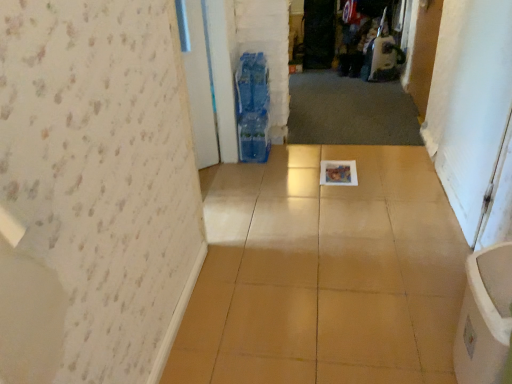
The image size is (512, 384). What do you see at coordinates (471, 106) in the screenshot?
I see `white glossy screen door at right, which is the 2th screen door in left-to-right order` at bounding box center [471, 106].

The height and width of the screenshot is (384, 512). Identify the location of white glossy screen door at right, which is the 2th screen door in left-to-right order. (471, 106).

In order to face transparent plastic screen door at center, the 2th screen door in the front-to-back sequence, should I rotate leftwards or rightwards?

Turn right approximately 8.483 degrees to face it.

You are a GUI agent. You are given a task and a screenshot of the screen. Output one action in this format:
    pyautogui.click(x=<x>, y=<y>)
    Task: Click on the wooden door at upper right
    This screenshot has height=384, width=512.
    Given the screenshot: What is the action you would take?
    pyautogui.click(x=424, y=53)

Is wooden door at upper right not within white glossy screen door at right, which is the 1th screen door from front to back?

Indeed, wooden door at upper right is completely outside white glossy screen door at right, which is the 1th screen door from front to back.

From a real-world perspective, is wooden door at upper right physically above white glossy screen door at right, which is the 2th screen door in left-to-right order?

No, from a real-world perspective, wooden door at upper right is not above white glossy screen door at right, which is the 2th screen door in left-to-right order.

Looking at this image, considering the sizes of wooden door at upper right and white glossy screen door at right, the 2th screen door from the top, in the image, is wooden door at upper right wider or thinner than white glossy screen door at right, the 2th screen door from the top,?

In the image, wooden door at upper right appears to be more narrow than white glossy screen door at right, the 2th screen door from the top.

Is white glossy screen door at right, which is the 1th screen door from front to back, shorter than transparent plastic screen door at center, the 2th screen door in the front-to-back sequence?

No.

Considering the sizes of objects white glossy screen door at right, which is the 2th screen door in left-to-right order, and transparent plastic screen door at center, the 1th screen door positioned from the back, in the image provided, who is thinner, white glossy screen door at right, which is the 2th screen door in left-to-right order, or transparent plastic screen door at center, the 1th screen door positioned from the back,?

white glossy screen door at right, which is the 2th screen door in left-to-right order.

From the image's perspective, would you say white glossy screen door at right, acting as the 1th screen door starting from the right, is positioned over transparent plastic screen door at center, the 1th screen door positioned from the back?

Actually, white glossy screen door at right, acting as the 1th screen door starting from the right, appears below transparent plastic screen door at center, the 1th screen door positioned from the back, in the image.

Is white glossy screen door at right, which appears as the second screen door when viewed from the back, not close to transparent plastic screen door at center, arranged as the 2th screen door when viewed from the right?

Yes, white glossy screen door at right, which appears as the second screen door when viewed from the back, and transparent plastic screen door at center, arranged as the 2th screen door when viewed from the right, are quite far apart.

Does point (433, 65) come in front of point (331, 16)?

Yes, point (433, 65) is in front of point (331, 16).

Is wooden door at upper right facing towards transparent plastic screen door at center, the 1th screen door positioned from the back?

No, wooden door at upper right is not aimed at transparent plastic screen door at center, the 1th screen door positioned from the back.

Between wooden door at upper right and transparent plastic screen door at center, the second screen door in the bottom-to-top sequence, which one has smaller width?

wooden door at upper right.

In terms of size, does wooden door at upper right appear bigger or smaller than transparent plastic screen door at center, the 2th screen door in the front-to-back sequence?

In the image, wooden door at upper right appears to be smaller than transparent plastic screen door at center, the 2th screen door in the front-to-back sequence.

Is white glossy screen door at right, the 2th screen door from the top, positioned far away from wooden door at upper right?

No.

From a real-world perspective, is white glossy screen door at right, which appears as the second screen door when viewed from the back, positioned over wooden door at upper right based on gravity?

Yes, from a real-world perspective, white glossy screen door at right, which appears as the second screen door when viewed from the back, is on top of wooden door at upper right.

Which of these two, white glossy screen door at right, positioned as the 1th screen door in bottom-to-top order, or wooden door at upper right, is smaller?

With smaller size is wooden door at upper right.

From the image's perspective, between white glossy screen door at right, which appears as the second screen door when viewed from the back, and wooden door at upper right, who is located below?

white glossy screen door at right, which appears as the second screen door when viewed from the back, is shown below in the image.

Are transparent plastic screen door at center, which is counted as the first screen door, starting from the left, and wooden door at upper right beside each other?

There is a gap between transparent plastic screen door at center, which is counted as the first screen door, starting from the left, and wooden door at upper right.

Is transparent plastic screen door at center, arranged as the 2th screen door when viewed from the right, oriented away from wooden door at upper right?

transparent plastic screen door at center, arranged as the 2th screen door when viewed from the right, is not turned away from wooden door at upper right.

Who is smaller, transparent plastic screen door at center, the first screen door from the top, or wooden door at upper right?

wooden door at upper right.

From the image's perspective, is transparent plastic screen door at center, which is counted as the first screen door, starting from the left, located above or below wooden door at upper right?

transparent plastic screen door at center, which is counted as the first screen door, starting from the left, is situated higher than wooden door at upper right in the image.

Does transparent plastic screen door at center, arranged as the 2th screen door when viewed from the right, touch white glossy screen door at right, which is the 2th screen door in left-to-right order?

No, transparent plastic screen door at center, arranged as the 2th screen door when viewed from the right, is not next to white glossy screen door at right, which is the 2th screen door in left-to-right order.

Consider the image. From a real-world perspective, who is located lower, transparent plastic screen door at center, which is counted as the first screen door, starting from the left, or white glossy screen door at right, the 2th screen door from the top?

transparent plastic screen door at center, which is counted as the first screen door, starting from the left, is physically lower.

How far apart are transparent plastic screen door at center, the second screen door in the bottom-to-top sequence, and white glossy screen door at right, which is the 1th screen door from front to back?

They are 7.72 feet apart.

From the image's perspective, which one is positioned higher, transparent plastic screen door at center, the 1th screen door positioned from the back, or white glossy screen door at right, which is the 1th screen door from front to back?

transparent plastic screen door at center, the 1th screen door positioned from the back, appears higher in the image.

This screenshot has width=512, height=384. There is a wooden door at upper right. Find the location of `screen door above it (from a real-world perspective)`. screen door above it (from a real-world perspective) is located at coordinates (471, 106).

Find the location of `screen door that is above the white glossy screen door at right, acting as the 1th screen door starting from the right (from the image's perspective)`. screen door that is above the white glossy screen door at right, acting as the 1th screen door starting from the right (from the image's perspective) is located at coordinates (319, 33).

From the image, which object appears to be farther from wooden door at upper right, transparent plastic screen door at center, the 2th screen door in the front-to-back sequence, or white glossy screen door at right, which is the 1th screen door from front to back?

transparent plastic screen door at center, the 2th screen door in the front-to-back sequence, is positioned further to the anchor wooden door at upper right.

Which object lies nearer to the anchor point transparent plastic screen door at center, the 2th screen door in the front-to-back sequence, wooden door at upper right or white glossy screen door at right, which is the 1th screen door from front to back?

wooden door at upper right is closer to transparent plastic screen door at center, the 2th screen door in the front-to-back sequence.

Based on their spatial positions, is white glossy screen door at right, the 2th screen door from the top, or wooden door at upper right closer to transparent plastic screen door at center, arranged as the 2th screen door when viewed from the right?

wooden door at upper right.

Based on their spatial positions, is transparent plastic screen door at center, the 1th screen door positioned from the back, or wooden door at upper right closer to white glossy screen door at right, which appears as the second screen door when viewed from the back?

wooden door at upper right is positioned closer to the anchor white glossy screen door at right, which appears as the second screen door when viewed from the back.

Which object lies further to the anchor point white glossy screen door at right, which is the 2th screen door in left-to-right order, wooden door at upper right or transparent plastic screen door at center, arranged as the 2th screen door when viewed from the right?

A: transparent plastic screen door at center, arranged as the 2th screen door when viewed from the right.

Looking at the image, which one is located further to wooden door at upper right, white glossy screen door at right, which appears as the second screen door when viewed from the back, or transparent plastic screen door at center, which is counted as the first screen door, starting from the left?

The object further to wooden door at upper right is transparent plastic screen door at center, which is counted as the first screen door, starting from the left.

What are the coordinates of `door positioned between white glossy screen door at right, which is the 2th screen door in left-to-right order, and transparent plastic screen door at center, the second screen door in the bottom-to-top sequence, from near to far` in the screenshot? It's located at pyautogui.click(x=424, y=53).